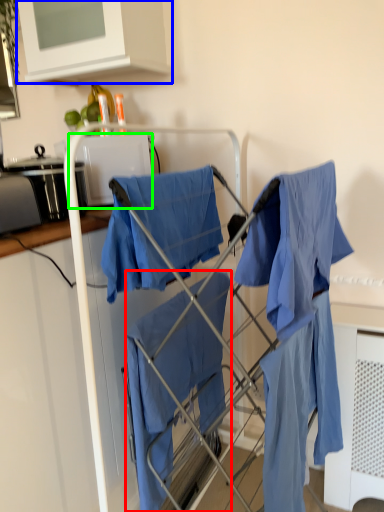
Question: Considering the real-world distances, which object is closest to cloak (highlighted by a red box)? cabinetry (highlighted by a blue box) or appliance (highlighted by a green box).

Choices:
 (A) cabinetry
 (B) appliance

Answer: (B)